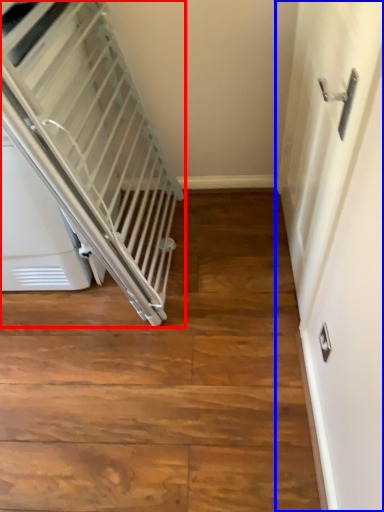
Question: Among these objects, which one is farthest to the camera, escalator (highlighted by a red box) or door (highlighted by a blue box)?

Choices:
 (A) escalator
 (B) door

Answer: (A)